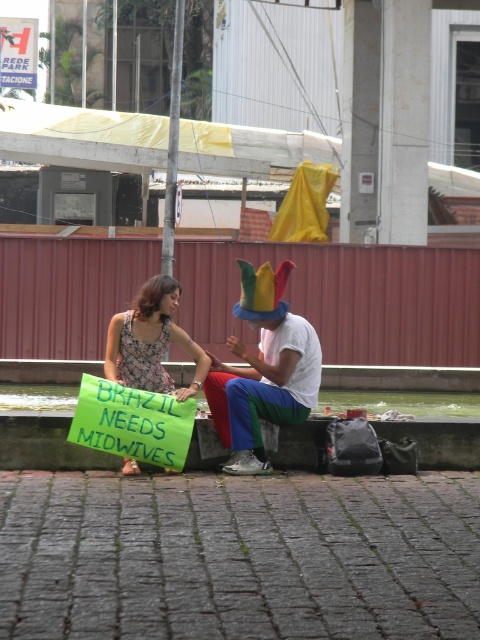
Question: Based on their relative distances, which object is nearer to the brick pavement at lower center?

Choices:
 (A) brick pavement at center
 (B) floral dress at center
 (C) multicolored fabric hat at center

Answer: (B)

Question: Is brick pavement at center smaller than floral dress at center?

Choices:
 (A) yes
 (B) no

Answer: (B)

Question: Where is brick pavement at center located in relation to brick pavement at lower center in the image?

Choices:
 (A) right
 (B) left

Answer: (A)

Question: Does brick pavement at center appear over multicolored fabric hat at center?

Choices:
 (A) yes
 (B) no

Answer: (B)

Question: Which point is farther to the camera?

Choices:
 (A) click(x=199, y=452)
 (B) click(x=119, y=589)
 (C) click(x=264, y=275)

Answer: (C)

Question: Among these points, which one is farthest from the camera?

Choices:
 (A) (158, 282)
 (B) (374, 369)

Answer: (B)